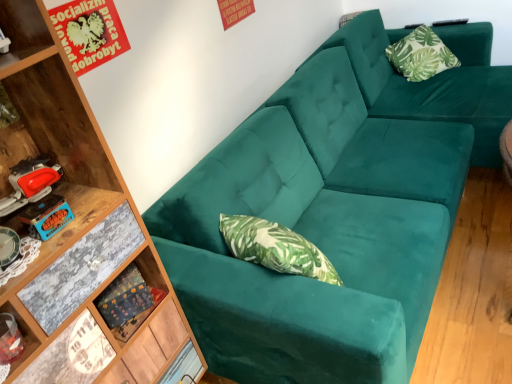
The height and width of the screenshot is (384, 512). What are the coordinates of `teal velvet couch at upper right` in the screenshot? It's located at (332, 212).

This screenshot has height=384, width=512. Identify the location of green leafy fabric pillow at upper right. coord(421,55).

Which of these two, green leafy fabric pillow at upper right or wooden shelf at lower left, is thinner?

wooden shelf at lower left is thinner.

Would you say green leafy fabric pillow at upper right is inside or outside wooden shelf at lower left?

green leafy fabric pillow at upper right is outside wooden shelf at lower left.

Is green leafy fabric pillow at upper right bigger than wooden shelf at lower left?

Yes.

Is teal velvet couch at upper right oriented away from green leafy fabric pillow at upper right?

Yes, green leafy fabric pillow at upper right is at the back of teal velvet couch at upper right.

Image resolution: width=512 pixels, height=384 pixels. Identify the location of pillow behind the teal velvet couch at upper right. (421, 55).

Between teal velvet couch at upper right and green leafy fabric pillow at upper right, which one appears on the left side from the viewer's perspective?

Positioned to the left is teal velvet couch at upper right.

What's the angular difference between teal velvet couch at upper right and green leafy fabric pillow at upper right's facing directions?

The angular difference between teal velvet couch at upper right and green leafy fabric pillow at upper right is 43.4 degrees.

Considering the relative sizes of teal velvet couch at upper right and wooden shelf at lower left in the image provided, is teal velvet couch at upper right wider than wooden shelf at lower left?

Indeed, teal velvet couch at upper right has a greater width compared to wooden shelf at lower left.

Is teal velvet couch at upper right turned away from wooden shelf at lower left?

No, teal velvet couch at upper right's orientation is not away from wooden shelf at lower left.

Can you tell me how much teal velvet couch at upper right and wooden shelf at lower left differ in facing direction?

The angular difference between teal velvet couch at upper right and wooden shelf at lower left is 16.6 degrees.

Are teal velvet couch at upper right and wooden shelf at lower left located far from each other?

No.

You are a GUI agent. You are given a task and a screenshot of the screen. Output one action in this format:
    pyautogui.click(x=<x>, y=<y>)
    Task: Click on the studio couch that appears below the green leafy fabric pillow at upper right (from a real-world perspective)
    This screenshot has width=512, height=384.
    Given the screenshot: What is the action you would take?
    pyautogui.click(x=332, y=212)

Is green leafy fabric pillow at upper right oriented away from teal velvet couch at upper right?

That's right, green leafy fabric pillow at upper right is facing away from teal velvet couch at upper right.

Between green leafy fabric pillow at upper right and teal velvet couch at upper right, which one has less height?

Standing shorter between the two is green leafy fabric pillow at upper right.

Looking at their sizes, would you say wooden shelf at lower left is wider or thinner than green leafy fabric pillow at upper right?

In the image, wooden shelf at lower left appears to be more narrow than green leafy fabric pillow at upper right.

Could you tell me if wooden shelf at lower left is turned towards green leafy fabric pillow at upper right?

No, wooden shelf at lower left does not turn towards green leafy fabric pillow at upper right.

Is wooden shelf at lower left completely or partially outside of green leafy fabric pillow at upper right?

wooden shelf at lower left is positioned outside green leafy fabric pillow at upper right.

Between point (132, 326) and point (380, 328), which one is positioned in front?

The point (380, 328) is closer to the camera.

Does wooden shelf at lower left lie in front of teal velvet couch at upper right?

No, wooden shelf at lower left is further to the viewer.

How many degrees apart are the facing directions of wooden shelf at lower left and teal velvet couch at upper right?

The angular difference between wooden shelf at lower left and teal velvet couch at upper right is 16.6 degrees.

Identify the location of shelf on the left of green leafy fabric pillow at upper right. point(128,287).

You are a GUI agent. You are given a task and a screenshot of the screen. Output one action in this format:
    pyautogui.click(x=<x>, y=<y>)
    Task: Click on the studio couch below the green leafy fabric pillow at upper right (from a real-world perspective)
    This screenshot has height=384, width=512.
    Given the screenshot: What is the action you would take?
    pyautogui.click(x=332, y=212)

Looking at the image, which one is located closer to teal velvet couch at upper right, green leafy fabric pillow at upper right or wooden shelf at lower left?

The object closer to teal velvet couch at upper right is green leafy fabric pillow at upper right.

Estimate the real-world distances between objects in this image. Which object is closer to green leafy fabric pillow at upper right, teal velvet couch at upper right or wooden shelf at lower left?

teal velvet couch at upper right is closer to green leafy fabric pillow at upper right.

Which object lies nearer to the anchor point wooden shelf at lower left, teal velvet couch at upper right or green leafy fabric pillow at upper right?

teal velvet couch at upper right.

Which object lies nearer to the anchor point green leafy fabric pillow at upper right, wooden shelf at lower left or teal velvet couch at upper right?

teal velvet couch at upper right is closer to green leafy fabric pillow at upper right.

Which object lies nearer to the anchor point wooden shelf at lower left, green leafy fabric pillow at upper right or teal velvet couch at upper right?

teal velvet couch at upper right.

Looking at the image, which one is located closer to teal velvet couch at upper right, wooden shelf at lower left or green leafy fabric pillow at upper right?

green leafy fabric pillow at upper right is closer to teal velvet couch at upper right.

What are the coordinates of `shelf located between teal velvet couch at upper right and green leafy fabric pillow at upper right in the depth direction` in the screenshot? It's located at (128, 287).